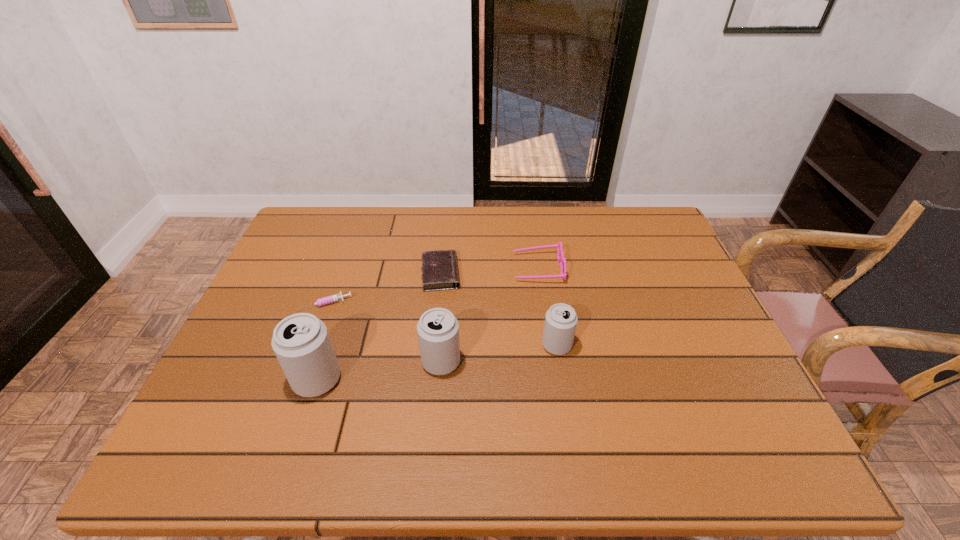
The width and height of the screenshot is (960, 540). What are the coordinates of `free point located on the back of the tallest can` in the screenshot? It's located at (351, 273).

Find the location of a particular element. This screenshot has height=540, width=960. vacant space located 0.230m on the left of the second can from left to right is located at coordinates (326, 362).

I want to click on free location located 0.290m on the back of the fourth shortest object, so click(x=543, y=261).

At what (x,y) coordinates should I click in order to perform the action: click on vacant region located 0.390m on the arms of the fourth tallest object. Please return your answer as a coordinate pair (x, y). The height and width of the screenshot is (540, 960). Looking at the image, I should click on (383, 268).

Find the location of a particular element. This screenshot has height=540, width=960. vacant space located 0.390m on the arms of the fourth tallest object is located at coordinates (383, 268).

Locate an element on the screen. vacant space located on the arms of the fourth tallest object is located at coordinates (400, 268).

Identify the location of free space located on the right of the shortest object. This screenshot has height=540, width=960. (471, 303).

Locate an element on the screen. The width and height of the screenshot is (960, 540). vacant space located 0.270m on the front of the diary is located at coordinates (431, 371).

Identify the location of object located at the near edge. The image size is (960, 540). (301, 342).

Image resolution: width=960 pixels, height=540 pixels. In order to click on object present at the left edge in this screenshot , I will do `click(323, 301)`.